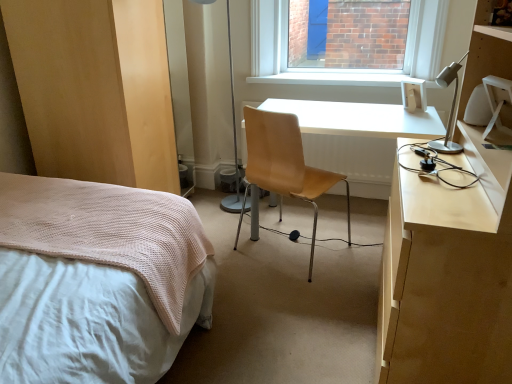
Find the location of a particular element. This screenshot has height=384, width=512. free space below white glossy desk at center (from a real-world perspective) is located at coordinates (341, 228).